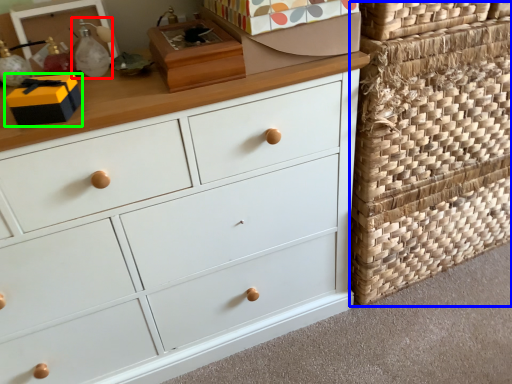
Question: Estimate the real-world distances between objects in this image. Which object is farther from toy (highlighted by a red box), basket (highlighted by a blue box) or storage box (highlighted by a green box)?

Choices:
 (A) basket
 (B) storage box

Answer: (A)